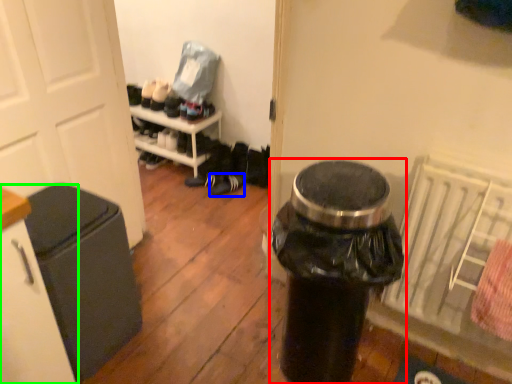
Question: Considering the real-world distances, which object is closest to waste container (highlighted by a red box)? footwear (highlighted by a blue box) or cabinetry (highlighted by a green box).

Choices:
 (A) footwear
 (B) cabinetry

Answer: (B)